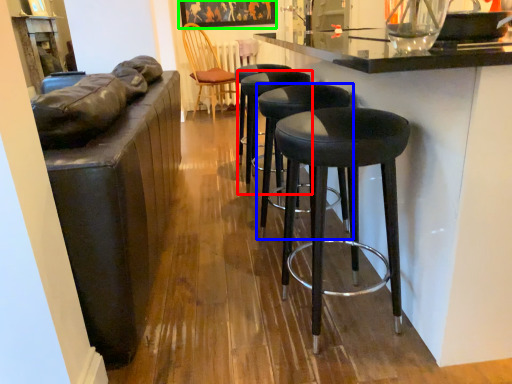
Question: Which is nearer to the stool (highlighted by a red box)? stool (highlighted by a blue box) or picture frame (highlighted by a green box).

Choices:
 (A) stool
 (B) picture frame

Answer: (A)